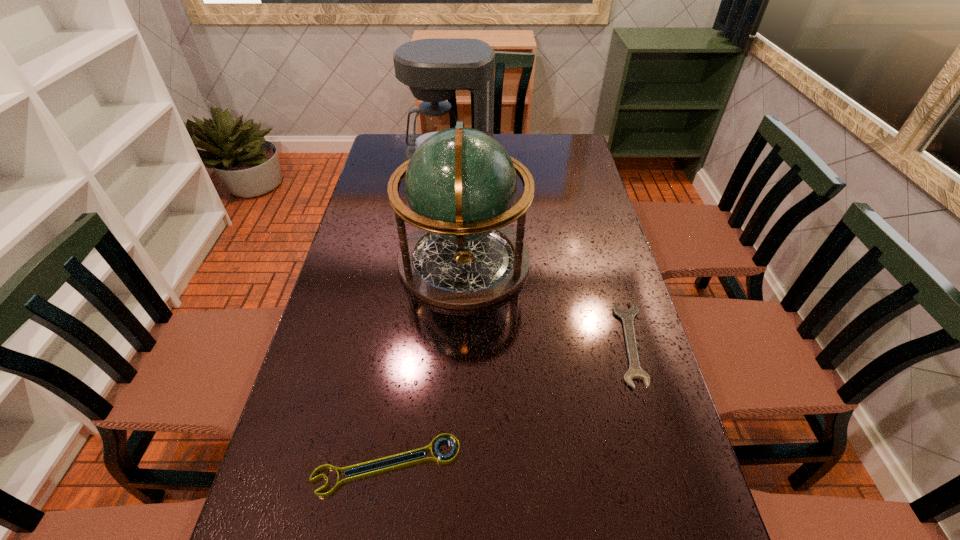
Where is `free point that satisfies the following two spatial constraints: 1. on the front-facing side of the rightmost object; 2. on the left side of the globe`? Image resolution: width=960 pixels, height=540 pixels. free point that satisfies the following two spatial constraints: 1. on the front-facing side of the rightmost object; 2. on the left side of the globe is located at coordinates (461, 343).

What are the coordinates of `free spot that satisfies the following two spatial constraints: 1. on the button side of the rightmost object; 2. on the right side of the coffee maker` in the screenshot? It's located at (434, 343).

The height and width of the screenshot is (540, 960). In order to click on free point that satisfies the following two spatial constraints: 1. on the back side of the farther wrench; 2. on the front-facing side of the globe in this screenshot , I will do `click(607, 261)`.

Locate an element on the screen. Image resolution: width=960 pixels, height=540 pixels. vacant area in the image that satisfies the following two spatial constraints: 1. on the front-facing side of the rightmost object; 2. on the left side of the globe is located at coordinates (461, 343).

Locate an element on the screen. vacant region that satisfies the following two spatial constraints: 1. on the button side of the farther wrench; 2. on the left side of the coffee maker is located at coordinates pos(434,343).

Locate an element on the screen. The width and height of the screenshot is (960, 540). blank space that satisfies the following two spatial constraints: 1. on the front-facing side of the globe; 2. on the left side of the rightmost object is located at coordinates (461, 343).

Where is `vacant region that satisfies the following two spatial constraints: 1. on the front-facing side of the globe; 2. on the left side of the rightmost object`? vacant region that satisfies the following two spatial constraints: 1. on the front-facing side of the globe; 2. on the left side of the rightmost object is located at coordinates (461, 343).